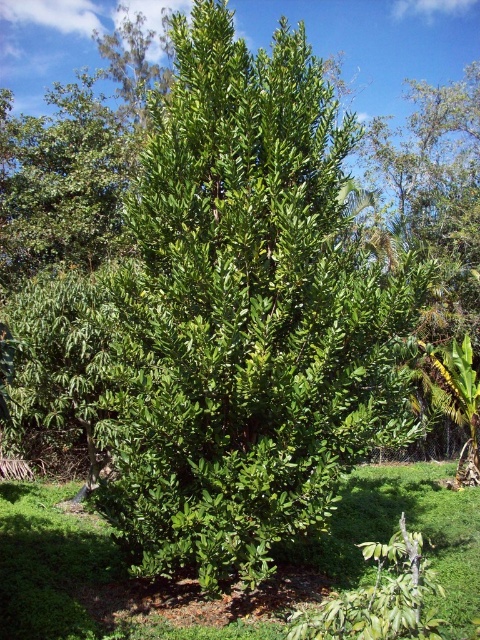
Question: From the image, what is the correct spatial relationship of green leafy grass at center in relation to green leafy tree at upper left?

Choices:
 (A) below
 (B) above

Answer: (A)

Question: Which object is the closest to the green leafy grass at center?

Choices:
 (A) green leafy bush at center
 (B) green leafy tree at upper left

Answer: (A)

Question: Among these objects, which one is farthest from the camera?

Choices:
 (A) green leafy bush at center
 (B) green leafy grass at center

Answer: (A)

Question: Which point is closer to the camera taking this photo?

Choices:
 (A) (95, 115)
 (B) (301, 296)
 (C) (453, 518)

Answer: (B)

Question: From the image, what is the correct spatial relationship of green leafy bush at center in relation to green leafy tree at upper left?

Choices:
 (A) above
 (B) below

Answer: (B)

Question: Is green leafy grass at center to the right of green leafy tree at upper left from the viewer's perspective?

Choices:
 (A) no
 (B) yes

Answer: (B)